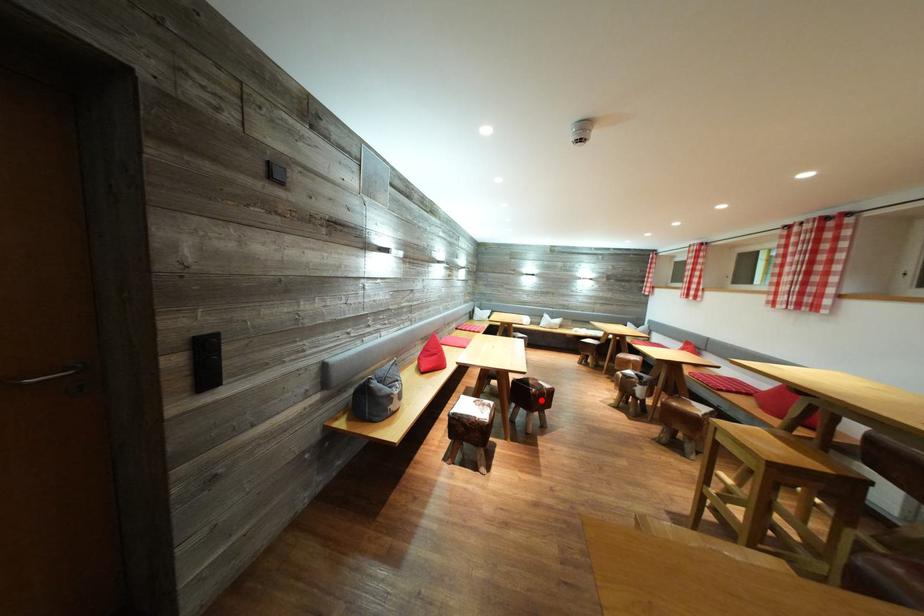
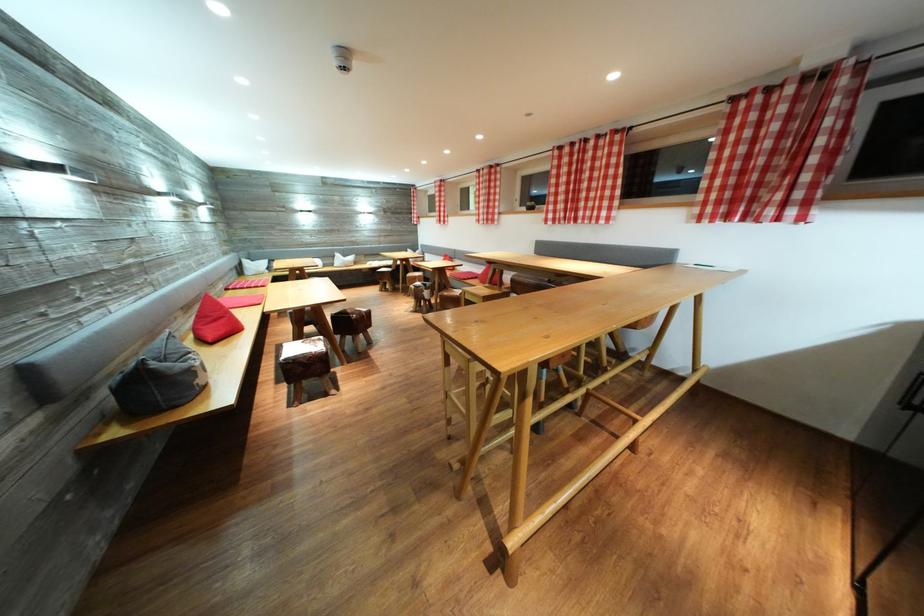
The point at the highlighted location is marked in the first image. Where is the corresponding point in the second image?

(362, 325)